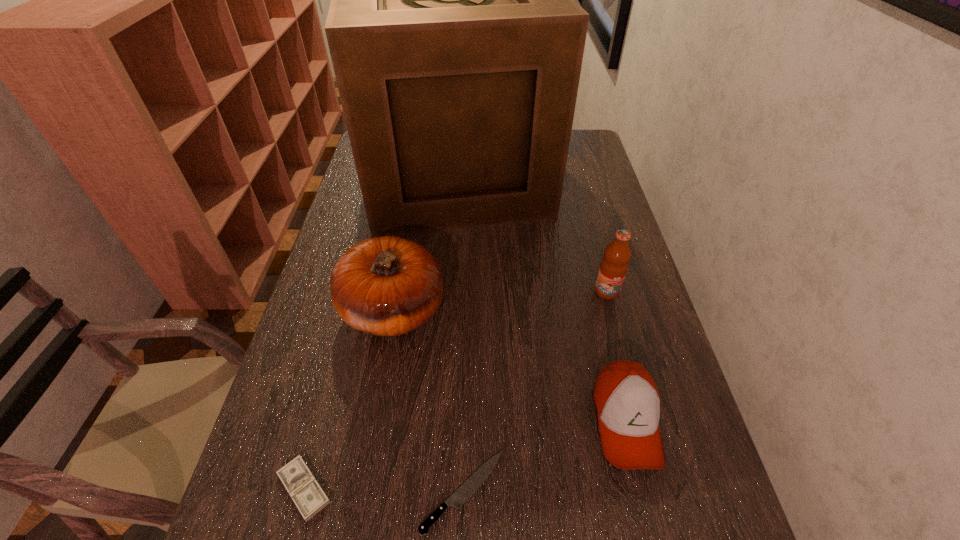
Image resolution: width=960 pixels, height=540 pixels. In order to click on the farthest object in this screenshot , I will do `click(457, 46)`.

Locate an element on the screen. Image resolution: width=960 pixels, height=540 pixels. box is located at coordinates (457, 46).

The width and height of the screenshot is (960, 540). What are the coordinates of `fruit juice` in the screenshot? It's located at (613, 267).

Find the location of `pumpkin`. pumpkin is located at coordinates (387, 286).

Where is `the third shortest object`? The width and height of the screenshot is (960, 540). the third shortest object is located at coordinates (626, 399).

What are the coordinates of `money` in the screenshot? It's located at (308, 496).

The height and width of the screenshot is (540, 960). What are the coordinates of `the shortest object` in the screenshot? It's located at (468, 488).

Where is `vacant space located on the front of the tallest object`? Image resolution: width=960 pixels, height=540 pixels. vacant space located on the front of the tallest object is located at coordinates (444, 333).

In order to click on vacant area located on the front label of the fruit juice in this screenshot , I will do `click(631, 380)`.

Locate an element on the screen. This screenshot has width=960, height=540. vacant area located 0.080m on the back of the pumpkin is located at coordinates (402, 253).